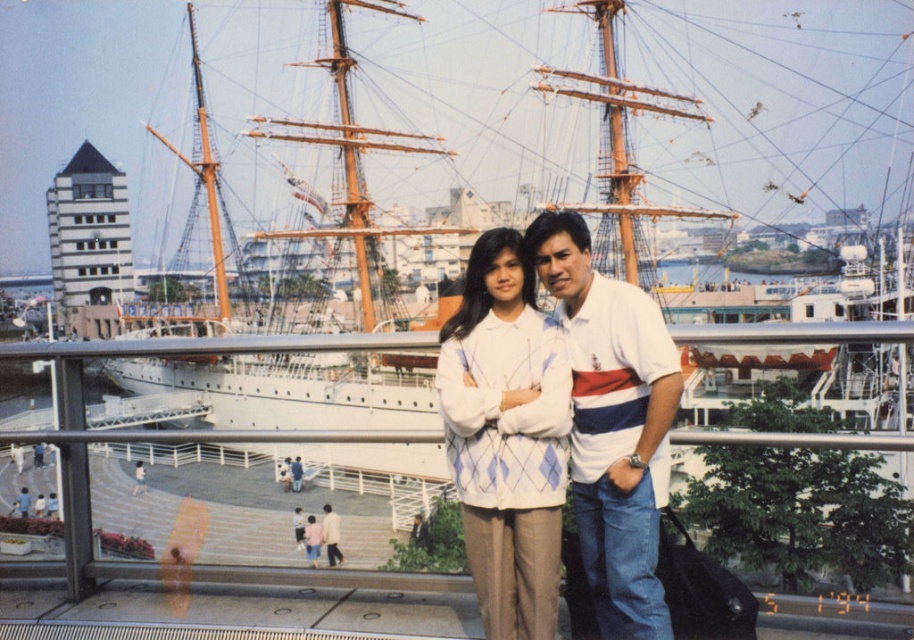
Question: Can you confirm if white knitwear at center is positioned to the left of light brown leather jacket at center?

Choices:
 (A) no
 (B) yes

Answer: (A)

Question: Which of the following is the closest to the observer?

Choices:
 (A) white knitwear at center
 (B) light brown leather jacket at center

Answer: (A)

Question: Which of the following is the farthest from the observer?

Choices:
 (A) (543, 237)
 (B) (323, 506)

Answer: (B)

Question: Is white knitwear at center positioned in front of light brown leather jacket at center?

Choices:
 (A) yes
 (B) no

Answer: (A)

Question: Can you confirm if white knitwear at center is thinner than light brown leather jacket at center?

Choices:
 (A) no
 (B) yes

Answer: (A)

Question: Which object is closer to the camera taking this photo?

Choices:
 (A) white knitwear at center
 (B) light brown leather jacket at center

Answer: (A)